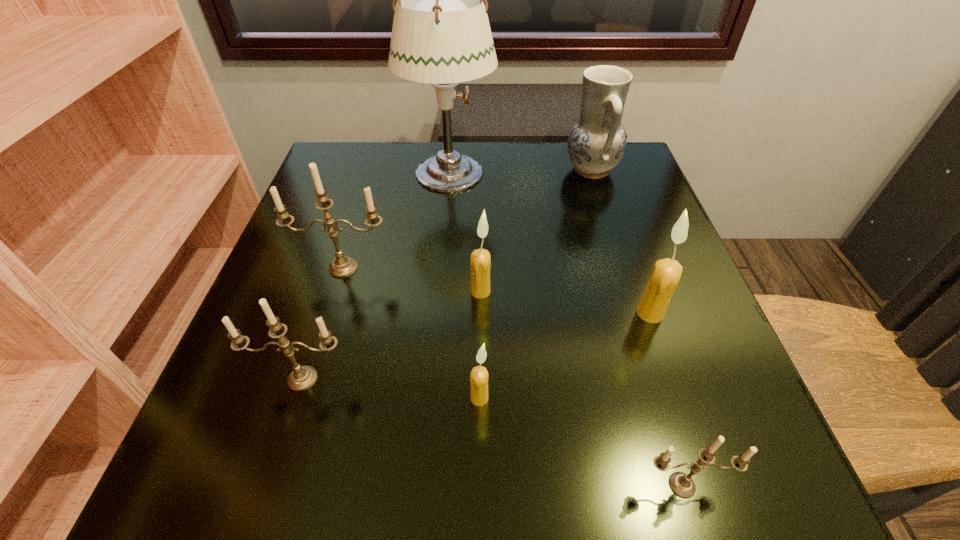
This screenshot has width=960, height=540. I want to click on lampshade that is at the far edge, so click(x=441, y=35).

Where is `pottery positioned at the far edge`? pottery positioned at the far edge is located at coordinates tap(596, 143).

Where is `object that is positioned at the near edge`? object that is positioned at the near edge is located at coordinates (681, 484).

The image size is (960, 540). Find the location of `pottery situated at the right edge`. pottery situated at the right edge is located at coordinates (596, 143).

The height and width of the screenshot is (540, 960). In order to click on object at the far right corner in this screenshot , I will do `click(596, 143)`.

Locate an element on the screen. The image size is (960, 540). object that is at the near right corner is located at coordinates (681, 484).

Find the location of a particular element. The height and width of the screenshot is (540, 960). vacant space at the far edge of the desktop is located at coordinates (469, 142).

The width and height of the screenshot is (960, 540). In the image, there is a desktop. In order to click on blank space at the near edge in this screenshot , I will do `click(496, 501)`.

Where is `free space at the left edge of the desktop`? Image resolution: width=960 pixels, height=540 pixels. free space at the left edge of the desktop is located at coordinates (358, 234).

In the image, there is a desktop. Where is `vacant area at the right edge`? The image size is (960, 540). vacant area at the right edge is located at coordinates (701, 327).